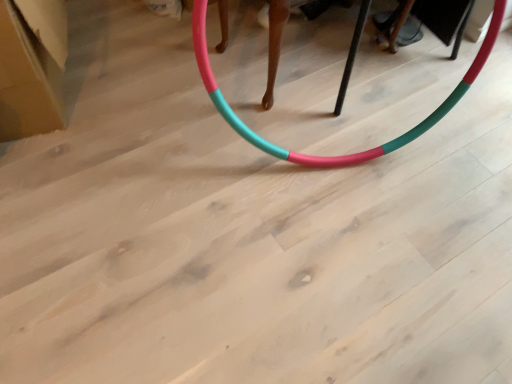
What do you see at coordinates (343, 155) in the screenshot?
I see `teal matte hula hoop at center` at bounding box center [343, 155].

Measure the distance between point (411,140) and camera.

Point (411,140) is 1.66 meters away from camera.

Find the location of a particular element. The image size is (512, 384). teal matte hula hoop at center is located at coordinates (343, 155).

What is the approximate width of teal matte hula hoop at center?

teal matte hula hoop at center is 13.84 inches wide.

Describe the element at coordinates (32, 67) in the screenshot. This screenshot has width=512, height=384. I see `white cardboard box at upper left` at that location.

At what (x,y) coordinates should I click in order to perform the action: click on white cardboard box at upper left. Please return your answer as a coordinate pair (x, y). This screenshot has width=512, height=384. Looking at the image, I should click on (32, 67).

This screenshot has height=384, width=512. What are the coordinates of `teal matte hula hoop at center` in the screenshot? It's located at (343, 155).

Considering the positions of objects teal matte hula hoop at center and white cardboard box at upper left in the image provided, who is more to the right, teal matte hula hoop at center or white cardboard box at upper left?

teal matte hula hoop at center.

Is teal matte hula hoop at center in front of white cardboard box at upper left?

Yes.

Does point (194, 26) come in front of point (30, 39)?

Yes, it is.

From the image's perspective, which object appears higher, teal matte hula hoop at center or white cardboard box at upper left?

white cardboard box at upper left appears higher in the image.

From a real-world perspective, relative to white cardboard box at upper left, is teal matte hula hoop at center vertically above or below?

In terms of real-world spatial position, teal matte hula hoop at center is above white cardboard box at upper left.

Can you confirm if teal matte hula hoop at center is thinner than white cardboard box at upper left?

Indeed, teal matte hula hoop at center has a lesser width compared to white cardboard box at upper left.

Consider the image. Is teal matte hula hoop at center taller or shorter than white cardboard box at upper left?

teal matte hula hoop at center is taller than white cardboard box at upper left.

Based on their sizes in the image, would you say teal matte hula hoop at center is bigger or smaller than white cardboard box at upper left?

Considering their sizes, teal matte hula hoop at center takes up more space than white cardboard box at upper left.

Is teal matte hula hoop at center located outside white cardboard box at upper left?

Yes, teal matte hula hoop at center is located beyond the bounds of white cardboard box at upper left.

Would you say teal matte hula hoop at center is a long distance from white cardboard box at upper left?

teal matte hula hoop at center is actually quite close to white cardboard box at upper left.

Is teal matte hula hoop at center facing away from white cardboard box at upper left?

No, white cardboard box at upper left is not at the back of teal matte hula hoop at center.

What's the angular difference between teal matte hula hoop at center and white cardboard box at upper left's facing directions?

They differ by 8.82 degrees in their facing directions.

Measure the distance from teal matte hula hoop at center to white cardboard box at upper left.

teal matte hula hoop at center and white cardboard box at upper left are 25.55 inches apart.

At what (x,y) coordinates should I click in order to perform the action: click on cardboard box on the left of teal matte hula hoop at center. Please return your answer as a coordinate pair (x, y). Looking at the image, I should click on (32, 67).

Can you confirm if white cardboard box at upper left is positioned to the left of teal matte hula hoop at center?

Yes, white cardboard box at upper left is to the left of teal matte hula hoop at center.

Which object is further away from the camera taking this photo, white cardboard box at upper left or teal matte hula hoop at center?

white cardboard box at upper left is further away from the camera.

Considering the points (39, 133) and (338, 161), which point is in front, point (39, 133) or point (338, 161)?

The point (39, 133) is in front.

From the image's perspective, is white cardboard box at upper left on teal matte hula hoop at center?

Indeed, from the image's perspective, white cardboard box at upper left is shown above teal matte hula hoop at center.

From a real-world perspective, which object stands above the other?

teal matte hula hoop at center.

In terms of width, does white cardboard box at upper left look wider or thinner when compared to teal matte hula hoop at center?

Clearly, white cardboard box at upper left has more width compared to teal matte hula hoop at center.

Can you confirm if white cardboard box at upper left is taller than teal matte hula hoop at center?

In fact, white cardboard box at upper left may be shorter than teal matte hula hoop at center.

Between white cardboard box at upper left and teal matte hula hoop at center, which one has smaller size?

With smaller size is white cardboard box at upper left.

Is teal matte hula hoop at center completely or partially inside white cardboard box at upper left?

Definitely not — teal matte hula hoop at center is not inside white cardboard box at upper left.

Based on the photo, is white cardboard box at upper left in contact with teal matte hula hoop at center?

They are not placed beside each other.

Is white cardboard box at upper left oriented away from teal matte hula hoop at center?

No.

How many degrees apart are the facing directions of white cardboard box at upper left and teal matte hula hoop at center?

They differ by 8.82 degrees in their facing directions.

I want to click on toy on the right of white cardboard box at upper left, so pos(343,155).

Locate an element on the screen. cardboard box that appears above the teal matte hula hoop at center (from the image's perspective) is located at coordinates (32, 67).

At what (x,y) coordinates should I click in order to perform the action: click on cardboard box below the teal matte hula hoop at center (from a real-world perspective). Please return your answer as a coordinate pair (x, y). Image resolution: width=512 pixels, height=384 pixels. Looking at the image, I should click on (32, 67).